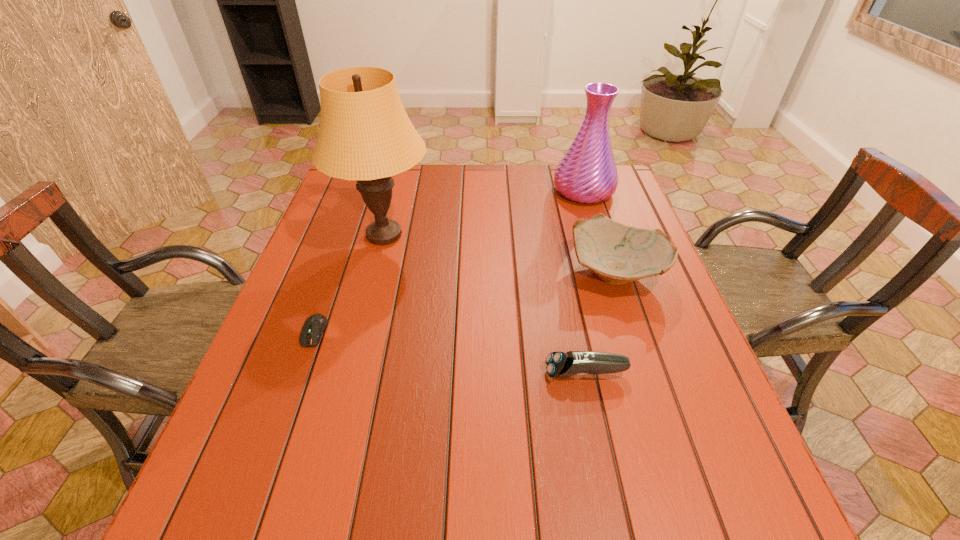
Where is `object located in the far right corner section of the desktop`? This screenshot has height=540, width=960. object located in the far right corner section of the desktop is located at coordinates (587, 173).

You are a GUI agent. You are given a task and a screenshot of the screen. Output one action in this format:
    pyautogui.click(x=<x>, y=<y>)
    Task: Click on the vacant area at the far edge
    The width and height of the screenshot is (960, 540).
    Given the screenshot: What is the action you would take?
    pyautogui.click(x=449, y=184)

At what (x,y) coordinates should I click in order to perform the action: click on vacant region at the near edge of the desktop. Please return your answer as a coordinate pair (x, y). This screenshot has width=960, height=540. Looking at the image, I should click on (419, 538).

You are a GUI agent. You are given a task and a screenshot of the screen. Output one action in this format:
    pyautogui.click(x=<x>, y=<y>)
    Task: Click on the vacant space at the left edge
    This screenshot has width=960, height=540.
    Given the screenshot: What is the action you would take?
    pyautogui.click(x=322, y=240)

Locate an element on the screen. The width and height of the screenshot is (960, 540). vacant space at the near left corner is located at coordinates (219, 504).

I want to click on vacant space in between the electric shaver and the fourth shortest object, so click(585, 282).

Identify the location of unoccupied position between the lampshade and the pottery. The image size is (960, 540). (500, 252).

The image size is (960, 540). In order to click on empty location between the nearest object and the tallest object in this screenshot , I will do `click(485, 304)`.

You are a GUI agent. You are given a task and a screenshot of the screen. Output one action in this format:
    pyautogui.click(x=<x>, y=<y>)
    Task: Click on the free space between the lampshade and the third tallest object
    Image resolution: width=960 pixels, height=540 pixels.
    Given the screenshot: What is the action you would take?
    pyautogui.click(x=500, y=252)

Identify the location of free space between the second nearest object and the third shortest object. (466, 301).